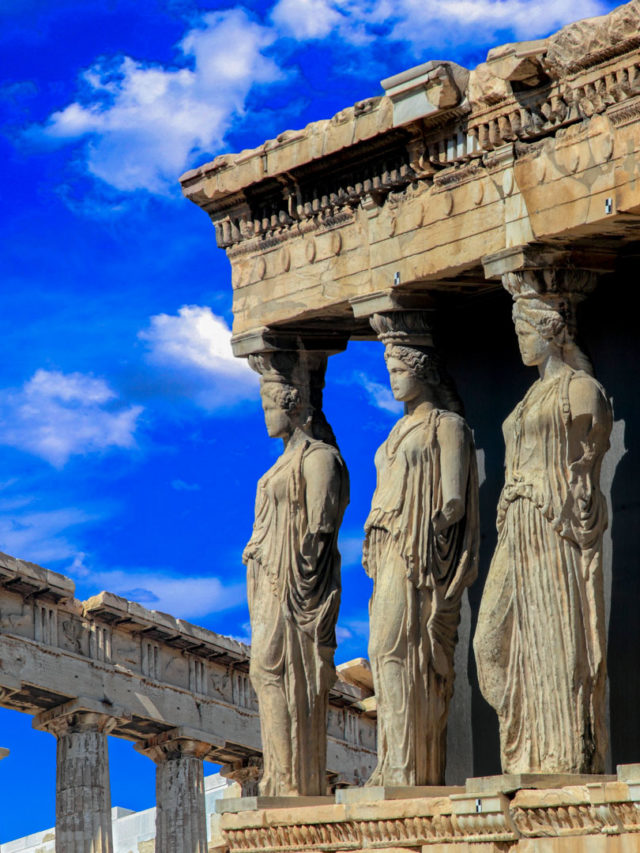
Where is `pillar`? This screenshot has height=853, width=640. pillar is located at coordinates (185, 805), (91, 815).